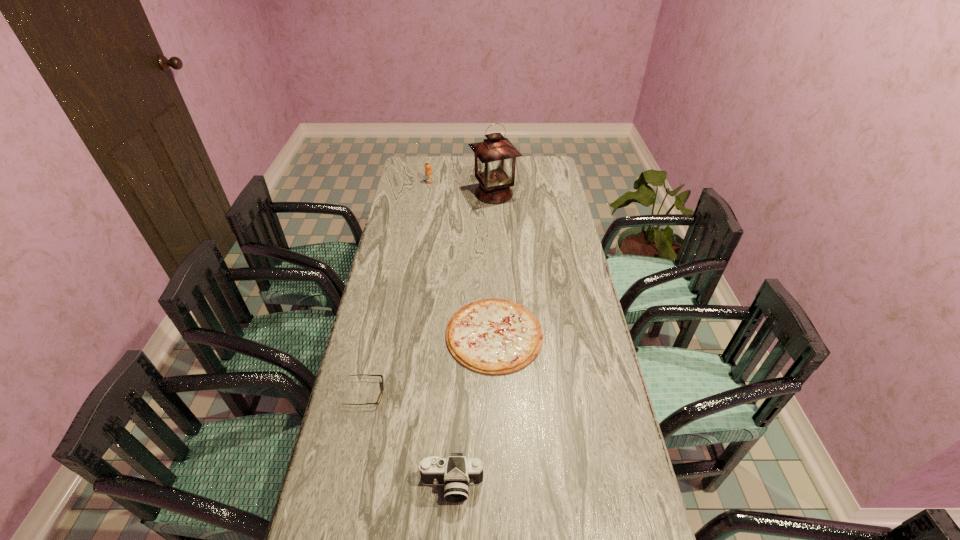
Image resolution: width=960 pixels, height=540 pixels. Identify the location of vacant area situated 0.380m on the front-facing side of the fourth tallest object. (514, 393).

Where is `blank space located on the front of the pizza`? blank space located on the front of the pizza is located at coordinates (499, 512).

Locate an element on the screen. orange juice present at the left edge is located at coordinates (428, 172).

The height and width of the screenshot is (540, 960). I want to click on sunglasses at the left edge, so click(380, 397).

Locate an element on the screen. Image resolution: width=960 pixels, height=540 pixels. vacant area at the left edge is located at coordinates (387, 263).

The image size is (960, 540). I want to click on vacant space at the right edge of the desktop, so click(550, 259).

You are a GUI agent. You are given a task and a screenshot of the screen. Output one action in this format:
    pyautogui.click(x=<x>, y=<y>)
    Task: Click on the vacant space at the far right corner of the desktop
    
    Given the screenshot: What is the action you would take?
    pyautogui.click(x=547, y=174)

I want to click on empty space that is in between the pizza and the second nearest object, so click(430, 364).

Locate an element on the screen. unoccupied position between the leftmost object and the camera is located at coordinates (409, 440).

Image resolution: width=960 pixels, height=540 pixels. In order to click on blank region between the tallest object and the sunglasses in this screenshot , I will do `click(430, 294)`.